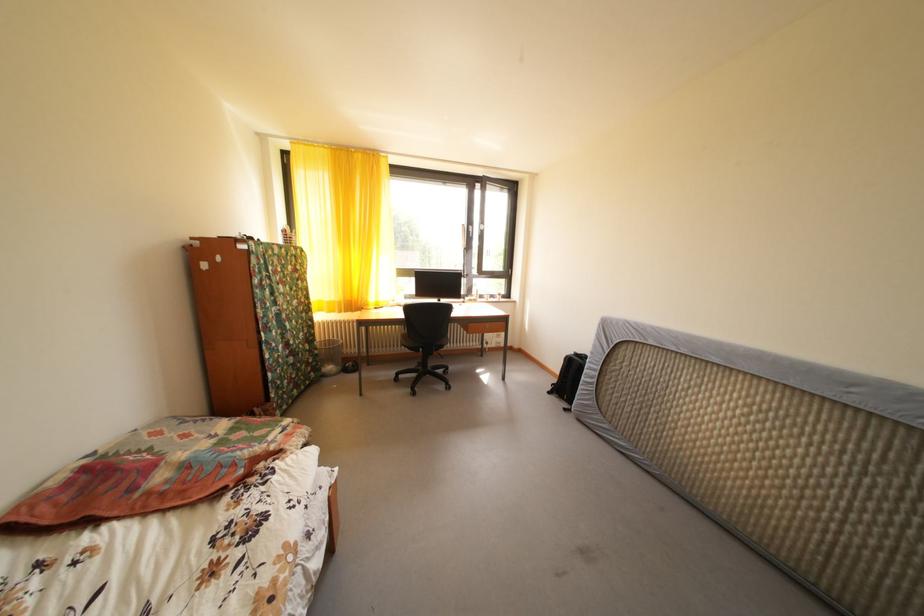
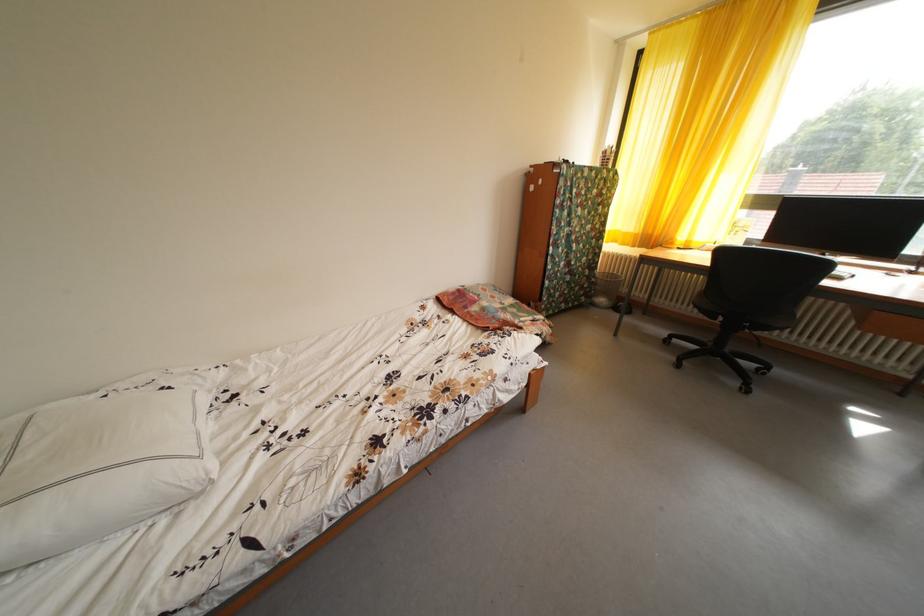
In the second image, find the point that corresponds to (320,367) in the first image.

(594, 292)